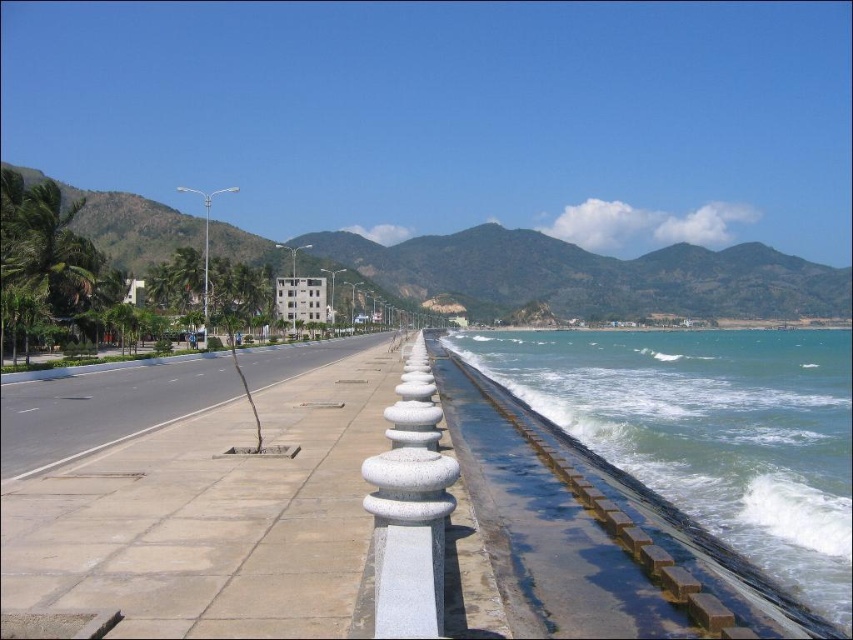
Question: Which object is the closest to the white stone pillar at center?

Choices:
 (A) greenish-blue water at lower right
 (B) light gray concrete sidewalk at center

Answer: (B)

Question: Which object appears closest to the camera in this image?

Choices:
 (A) greenish-blue water at lower right
 (B) light gray concrete sidewalk at center
 (C) white stone pillar at center

Answer: (C)

Question: Can you confirm if light gray concrete sidewalk at center is positioned below greenish-blue water at lower right?

Choices:
 (A) yes
 (B) no

Answer: (B)

Question: Which object is closer to the camera taking this photo?

Choices:
 (A) light gray concrete sidewalk at center
 (B) white stone pillar at center
 (C) greenish-blue water at lower right

Answer: (B)

Question: Can you confirm if light gray concrete sidewalk at center is positioned below greenish-blue water at lower right?

Choices:
 (A) yes
 (B) no

Answer: (B)

Question: Does light gray concrete sidewalk at center appear on the right side of greenish-blue water at lower right?

Choices:
 (A) yes
 (B) no

Answer: (B)